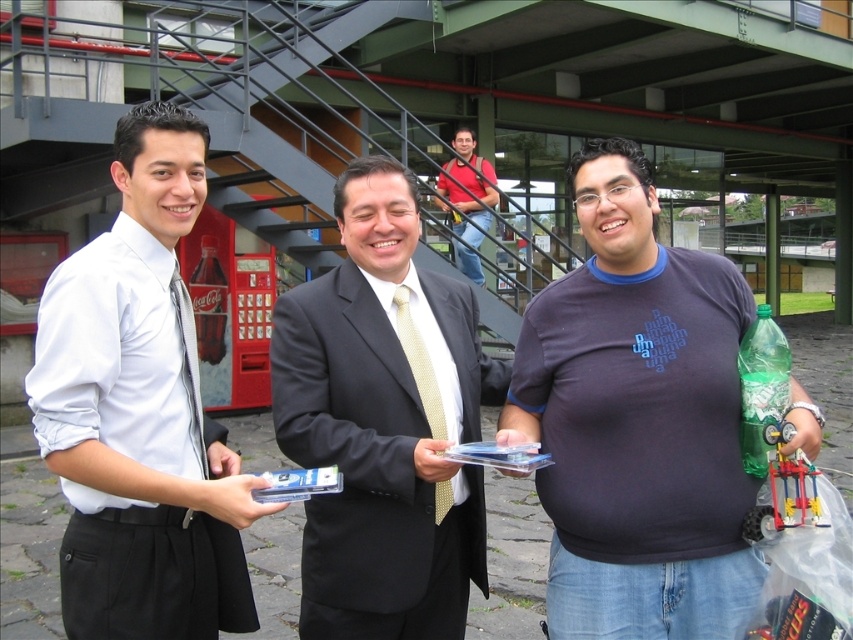
Who is shorter, white satin shirt at left or red cotton shirt at center?

white satin shirt at left is shorter.

Does white satin shirt at left appear on the left side of red cotton shirt at center?

Indeed, white satin shirt at left is positioned on the left side of red cotton shirt at center.

Where is `white satin shirt at left`? The height and width of the screenshot is (640, 853). white satin shirt at left is located at coordinates (140, 412).

Who is more distant from viewer, (352,224) or (460,148)?

Positioned behind is point (460,148).

Image resolution: width=853 pixels, height=640 pixels. In order to click on matte black suit at center in this screenshot , I will do `click(384, 422)`.

Between point (578, 362) and point (245, 609), which one is positioned in front?

Point (578, 362) is in front.

Does dark blue cotton t-shirt at center appear on the right side of white satin shirt at left?

Indeed, dark blue cotton t-shirt at center is positioned on the right side of white satin shirt at left.

I want to click on dark blue cotton t-shirt at center, so click(x=637, y=420).